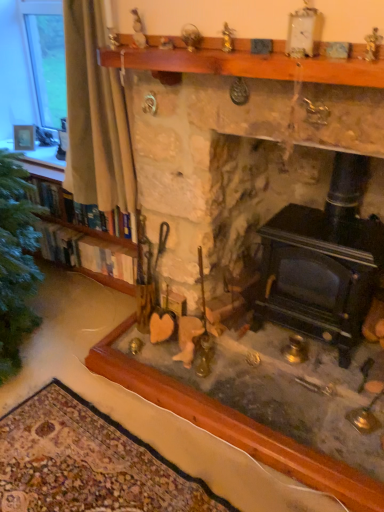
The image size is (384, 512). In order to click on free point above wooden mantle at upper center (from a real-world perspective) in this screenshot , I will do pyautogui.click(x=240, y=37).